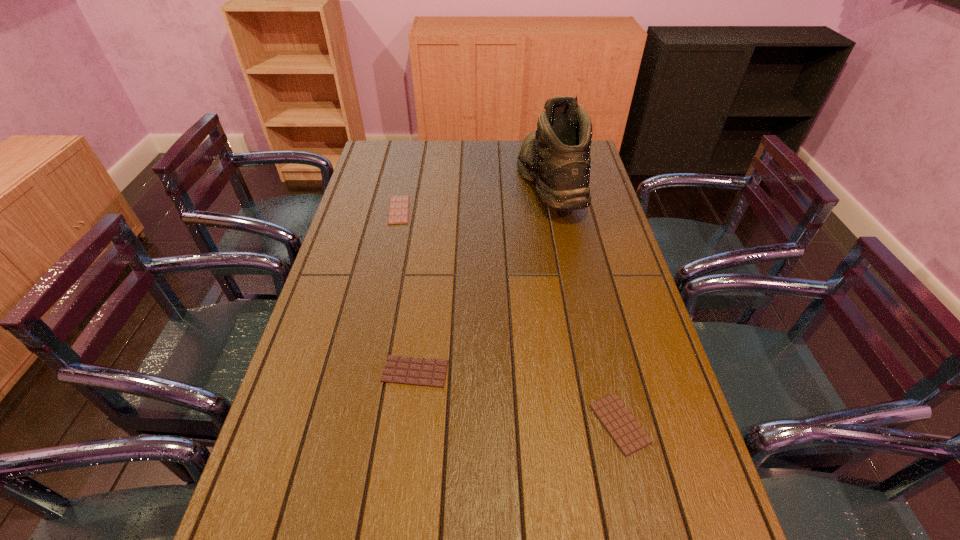
Where is `free space located on the left of the second nearest object`? free space located on the left of the second nearest object is located at coordinates (338, 372).

Where is `object that is positioned at the far edge`? Image resolution: width=960 pixels, height=540 pixels. object that is positioned at the far edge is located at coordinates (556, 157).

You are a GUI agent. You are given a task and a screenshot of the screen. Output one action in this format:
    pyautogui.click(x=<x>, y=<y>)
    Task: Click on the object that is at the left edge
    Image resolution: width=960 pixels, height=540 pixels.
    Given the screenshot: What is the action you would take?
    pyautogui.click(x=398, y=213)

Identify the location of ski boot that is at the right edge. (556, 157).

At what (x,y) coordinates should I click in order to perform the action: click on chocolate bar at the right edge. Please return your answer as a coordinate pair (x, y). This screenshot has width=960, height=540. Looking at the image, I should click on (628, 435).

Where is `object that is at the far right corner`? The image size is (960, 540). object that is at the far right corner is located at coordinates (556, 157).

At what (x,y) coordinates should I click in order to perform the action: click on vacant space at the far edge of the desktop. Please return your answer as a coordinate pair (x, y). This screenshot has height=540, width=960. Looking at the image, I should click on point(451,158).

Identify the location of vacant space at the left edge. (366, 221).

Locate an element on the screen. The image size is (960, 540). vacant point at the right edge is located at coordinates (600, 208).

Identify the location of free space between the leftmost object and the tallest chocolate bar. The image size is (960, 540). (509, 317).